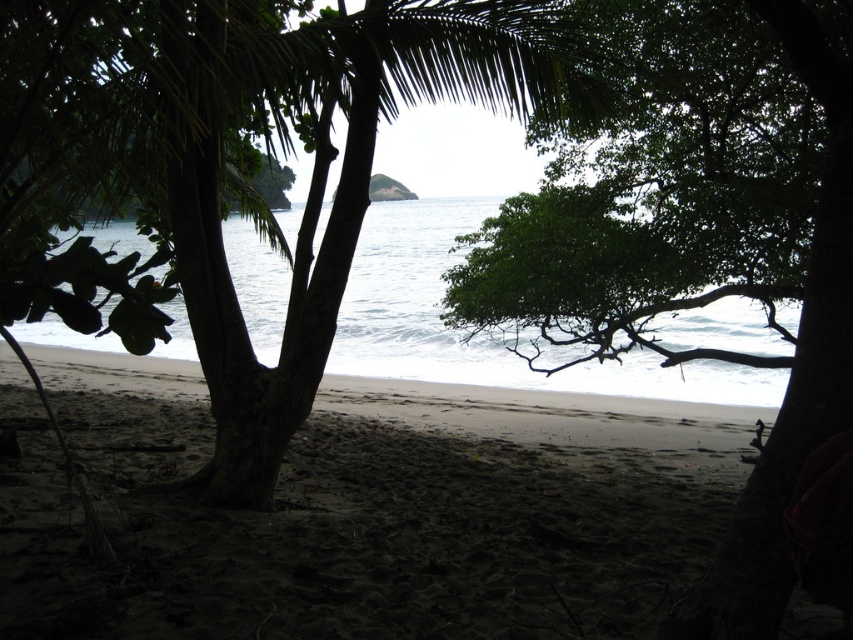
Question: Which object is farther from the camera taking this photo?

Choices:
 (A) green leafy palm tree at center
 (B) green leafy tree at center

Answer: (B)

Question: Which object is closer to the camera taking this photo?

Choices:
 (A) white smooth water at center
 (B) green leafy tree at center
 (C) green leafy palm tree at center

Answer: (A)

Question: Can you confirm if green leafy tree at center is bigger than white smooth water at center?

Choices:
 (A) yes
 (B) no

Answer: (B)

Question: Does green leafy tree at center appear on the left side of white smooth water at center?

Choices:
 (A) yes
 (B) no

Answer: (B)

Question: Among these points, which one is farthest from the camera?

Choices:
 (A) (747, 342)
 (B) (770, 563)
 (C) (132, 3)

Answer: (A)

Question: Is green leafy tree at center below white smooth water at center?

Choices:
 (A) no
 (B) yes

Answer: (A)